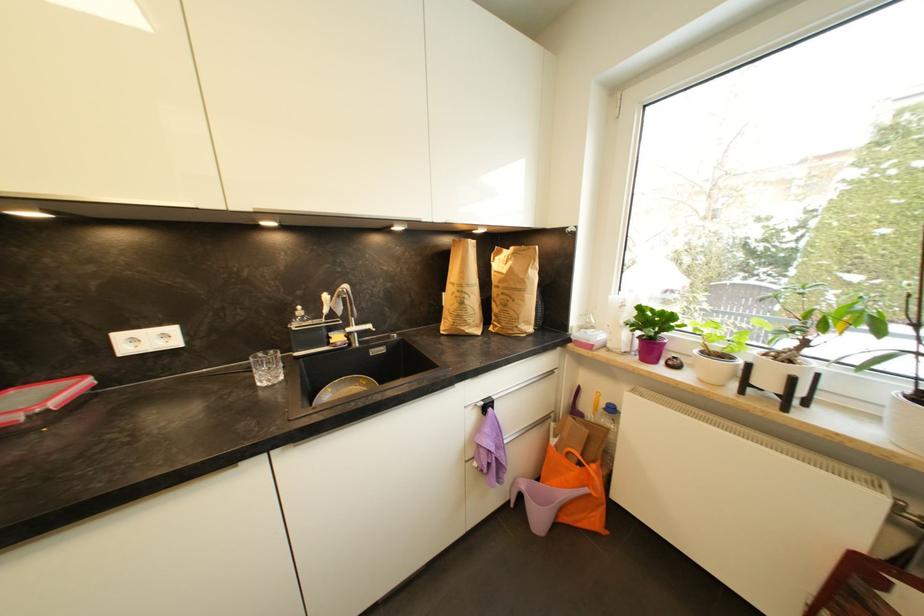
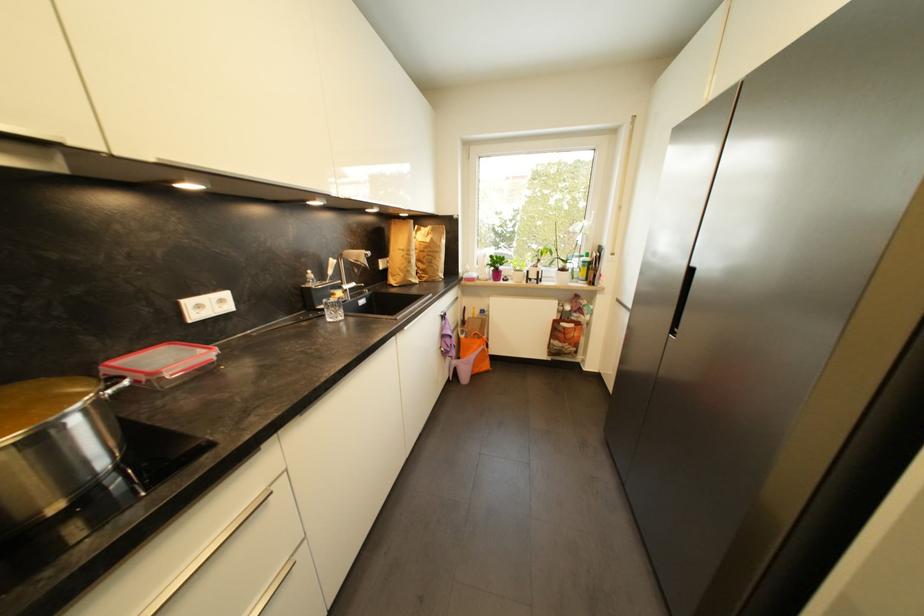
Find the pixel in the second image that matches [362,326] in the first image.

(353, 285)